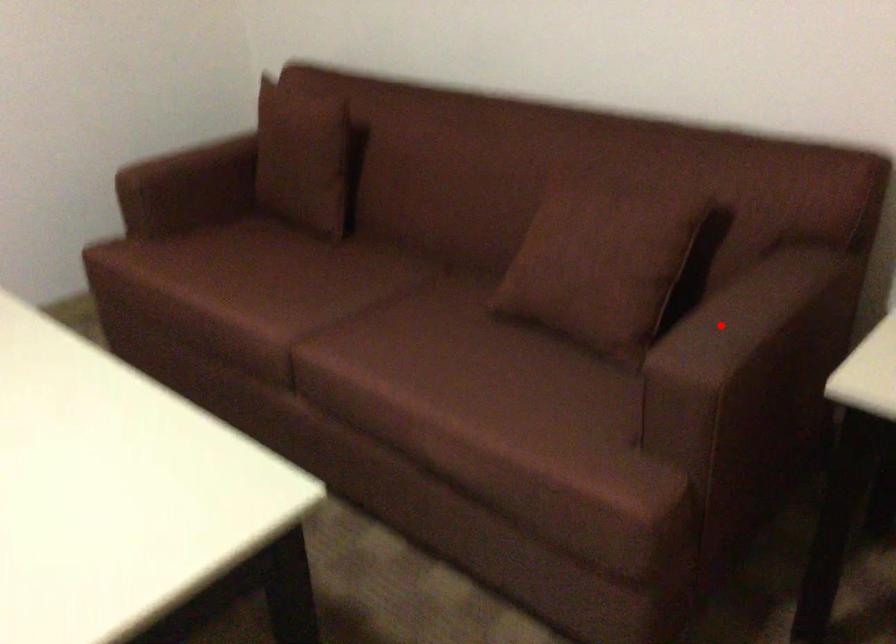
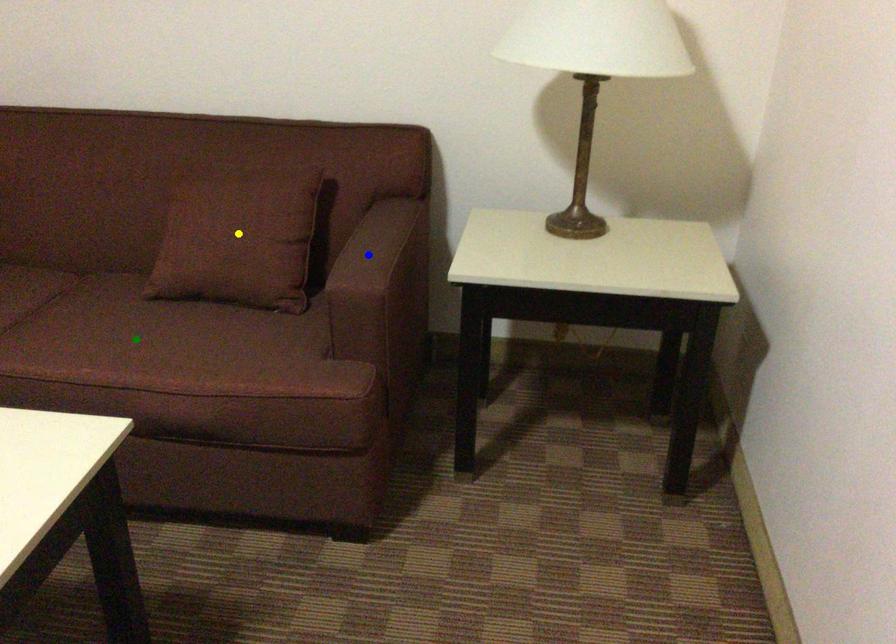
Question: I am providing you with two images of the same scene from different viewpoints. A red point is marked on the first image. You are given multiple points on the second image. In image 2, which mark is for the same physical point as the one in image 1?

Choices:
 (A) blue point
 (B) yellow point
 (C) green point

Answer: (A)